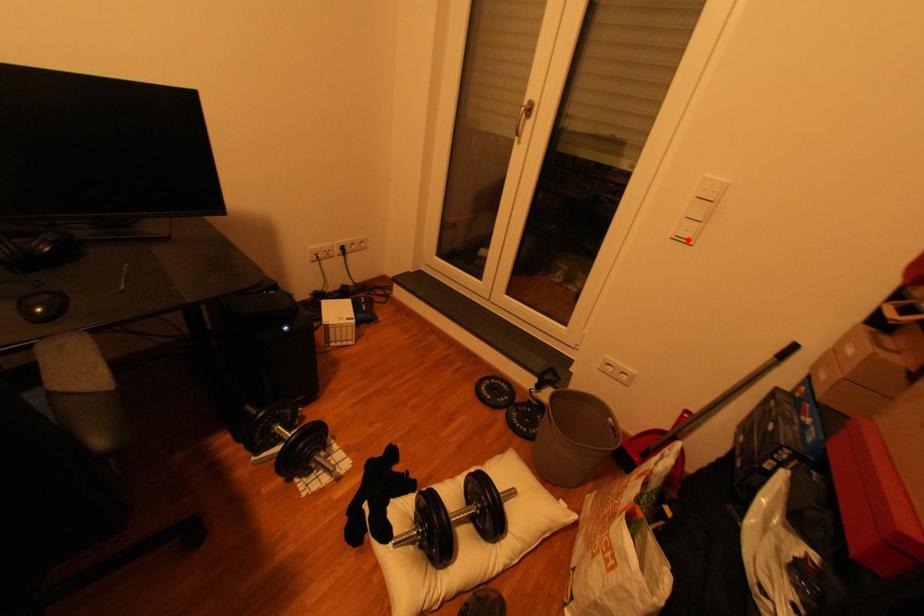
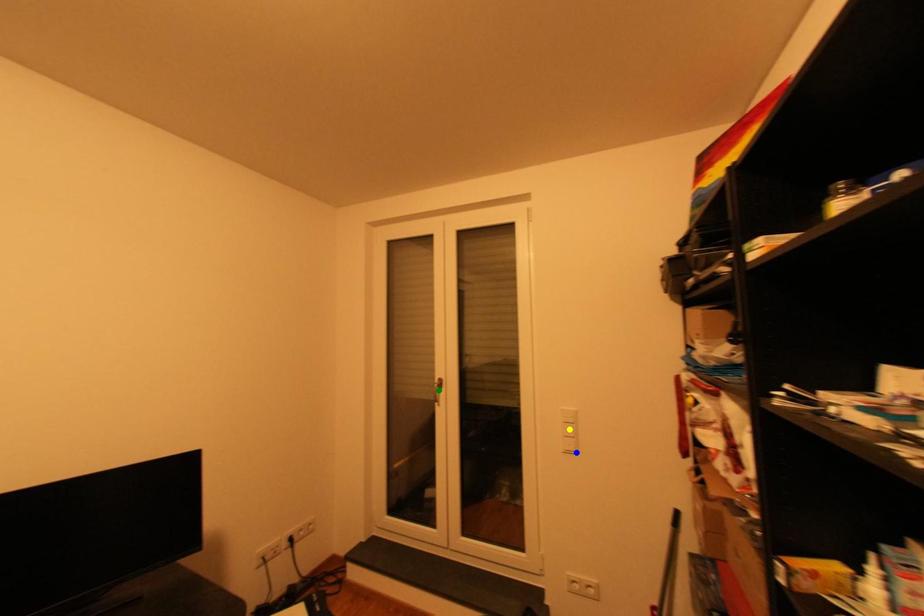
Question: I am providing you with two images of the same scene from different viewpoints. A red point is marked on the first image. You are given multiple points on the second image. Which point in image 2 represents the same 3d spot as the red point in image 1?

Choices:
 (A) blue point
 (B) green point
 (C) yellow point

Answer: (A)